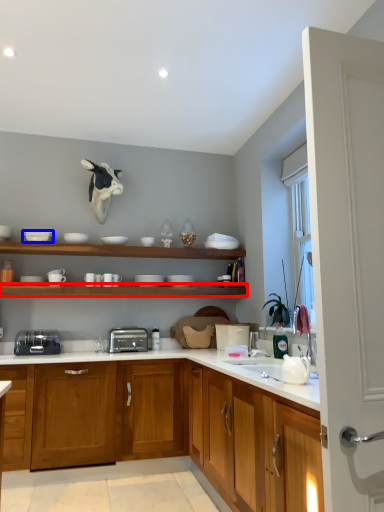
Question: Which object is further to the camera taking this photo, shelf (highlighted by a red box) or tableware (highlighted by a blue box)?

Choices:
 (A) shelf
 (B) tableware

Answer: (B)